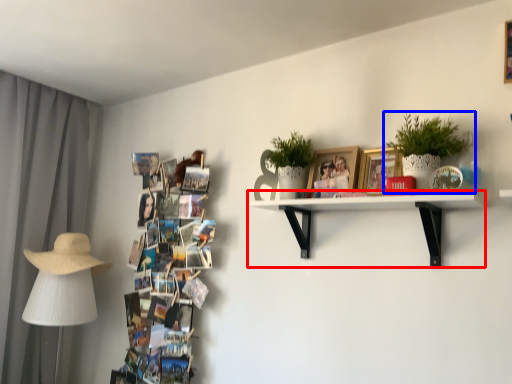
Question: Among these objects, which one is farthest to the camera, shelf (highlighted by a red box) or houseplant (highlighted by a blue box)?

Choices:
 (A) shelf
 (B) houseplant

Answer: (B)